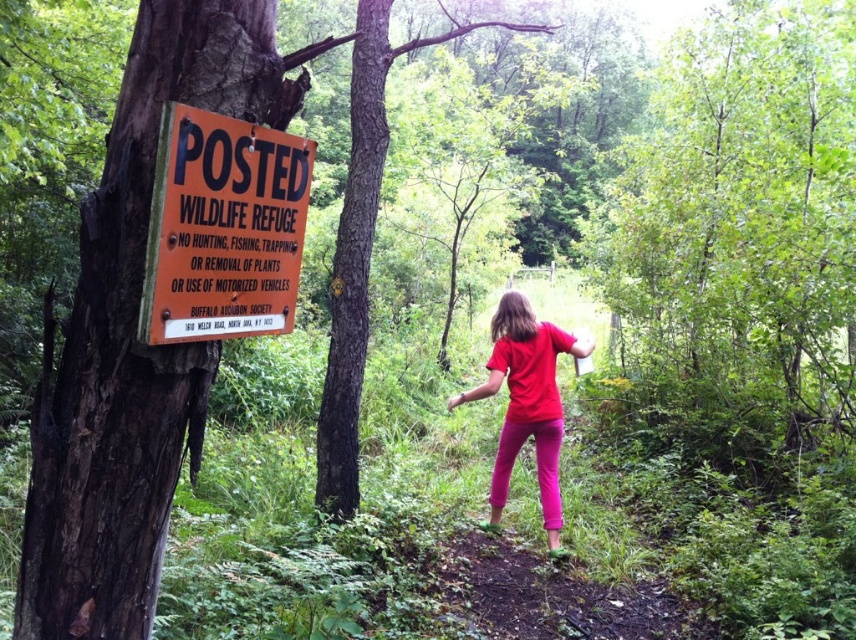
Which is above, orange paper sign at left or matte red shirt at center?

Positioned higher is orange paper sign at left.

Which is in front, point (177, 323) or point (551, 394)?

Point (177, 323) is in front.

Where is `orange paper sign at left`? The image size is (856, 640). orange paper sign at left is located at coordinates (223, 228).